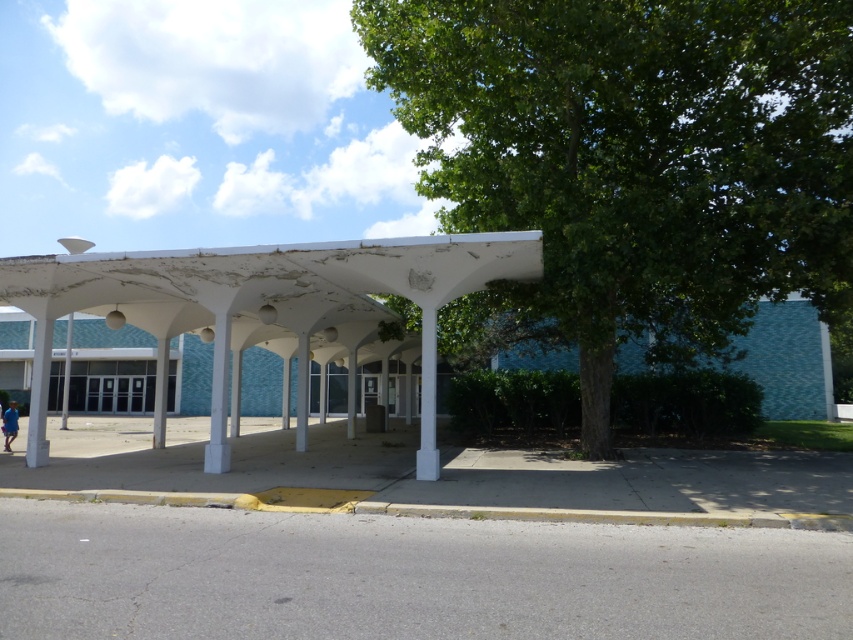
You are planning to install a new bench between the white matte pergola at center and the blue fabric at left. The bench requires a minimum of 5 meters of space between the two objects to be placed safely. Can you install the bench in this location?

The distance between the white matte pergola at center and the blue fabric at left is 8.61 meters, which exceeds the required 5 meters. Therefore, the bench can be safely installed in this location.

Looking at this image, you are standing in front of the structure and want to walk to the yellow curb. Which direction should you move relative to the green leafy tree at center and the white smooth column at center?

To reach the yellow curb, you should move to the left of the green leafy tree at center and the white smooth column at center because the yellow curb is located in front of the structure, and the tree is on the right side of the column. Moving left relative to both objects will lead you towards the curb.

Consider the image. You are standing in front of the white matte pergola at center and want to walk towards the green leafy tree at center. Which direction should you face to move directly towards it?

You should face to the right to move directly towards the green leafy tree at center since it is located to the right of the white matte pergola at center.